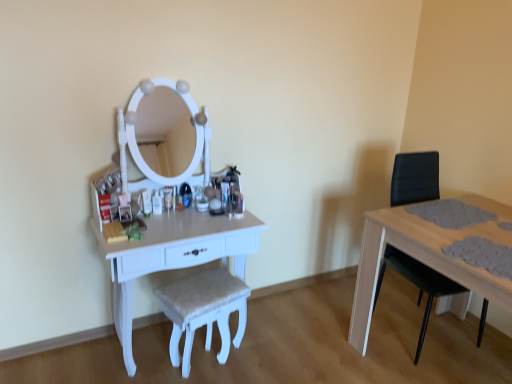
Find the location of a particular element. This screenshot has width=512, height=384. free space that is to the left of black leather swivel chair at right is located at coordinates (332, 327).